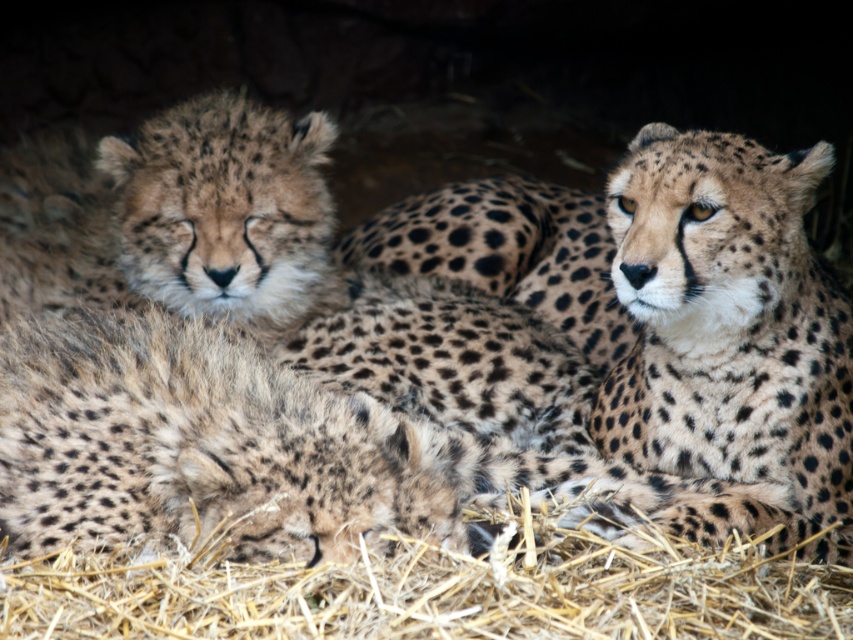
You are a zookeeper observing the cheetahs in their enclosure. You notice the spotted fur cheetah at upper right and the brown straw at lower center. Which object is closer to you?

The spotted fur cheetah at upper right is closer to you because the brown straw at lower center is behind it.

You are a wildlife photographer trying to capture the spotted fur cheetah at upper right and the brown straw at lower center in the same frame. Since you want to emphasize the cheetah, which subject should you focus on to ensure it remains sharp, and why?

You should focus on the spotted fur cheetah at upper right because it is thinner than the brown straw at lower center, making it easier to keep in sharp focus with a narrower depth of field.

In the image, there are two cheetahs and some straw. The spotted fur cheetah at upper right and the brown straw at lower center are both present. Which of these two objects is positioned to the right of the other?

The spotted fur cheetah at upper right is to the right of brown straw at lower center.